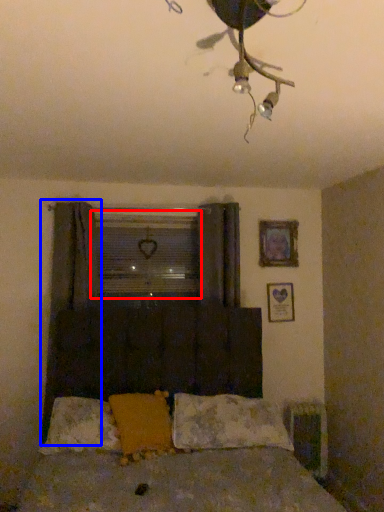
Question: Which point is closer to the camera, window screen (highlighted by a red box) or curtain (highlighted by a blue box)?

Choices:
 (A) window screen
 (B) curtain

Answer: (B)